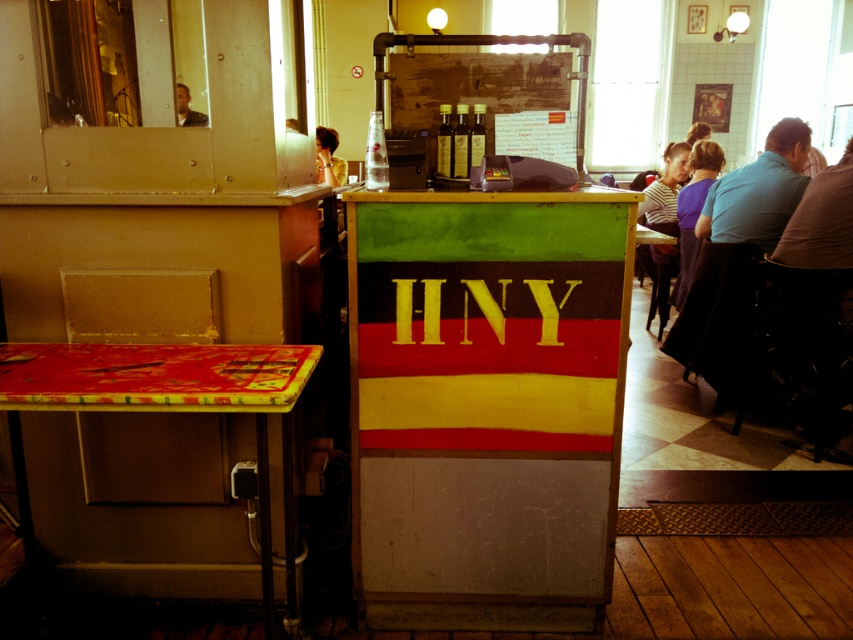
Question: Can you confirm if shiny plastic table at left is positioned to the right of matte black hair at upper left?

Choices:
 (A) no
 (B) yes

Answer: (B)

Question: Which of the following is the farthest from the observer?

Choices:
 (A) shiny plastic table at left
 (B) matte black hair at upper left
 (C) yellow shirt at upper left
 (D) blue fabric shirt at right

Answer: (C)

Question: Considering the real-world distances, which object is farthest from the shiny plastic table at left?

Choices:
 (A) blue fabric shirt at right
 (B) yellow shirt at upper left

Answer: (B)

Question: Among these objects, which one is farthest from the camera?

Choices:
 (A) matte black hair at upper left
 (B) yellow shirt at upper left
 (C) blue fabric shirt at right
 (D) shiny plastic table at left

Answer: (B)

Question: Is yellow shirt at upper left positioned in front of matte black hair at upper left?

Choices:
 (A) no
 (B) yes

Answer: (A)

Question: Is shiny plastic table at left wider than matte black hair at upper left?

Choices:
 (A) yes
 (B) no

Answer: (A)